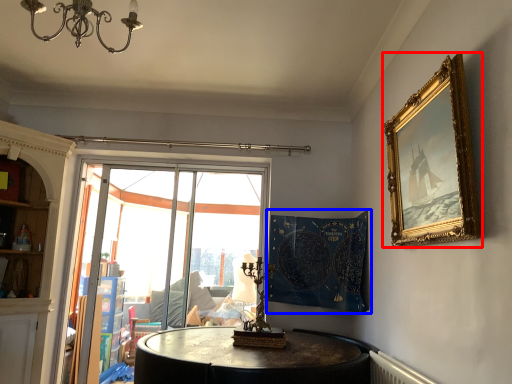
Question: Which of the following is the closest to the observer, picture frame (highlighted by a red box) or tapestry (highlighted by a blue box)?

Choices:
 (A) picture frame
 (B) tapestry

Answer: (A)